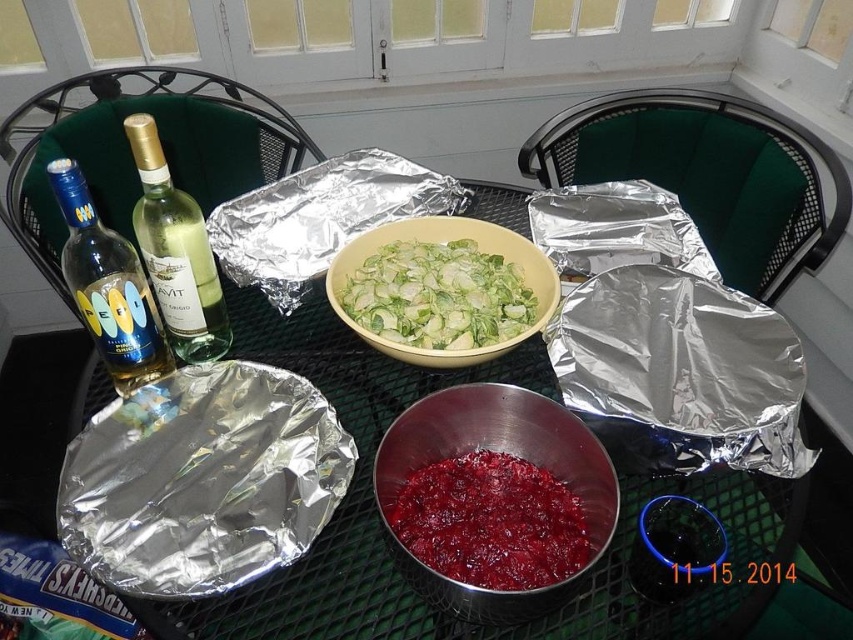
Question: Can you confirm if matte glass bottle at left is positioned above green glass bottle at upper left?

Choices:
 (A) no
 (B) yes

Answer: (A)

Question: Which of the following is the closest to the observer?

Choices:
 (A) (102, 390)
 (B) (424, 547)
 (C) (337, 308)

Answer: (B)

Question: In this image, where is metallic foil at center located relative to metallic silver bowl at lower center?

Choices:
 (A) below
 (B) above

Answer: (B)

Question: In this image, where is metallic silver bowl at lower center located relative to matte glass bottle at left?

Choices:
 (A) below
 (B) above

Answer: (A)

Question: Estimate the real-world distances between objects in this image. Which object is closer to the yellow matte bowl at center?

Choices:
 (A) shiny metallic cranberry sauce at center
 (B) matte glass bottle at left
 (C) green glass bottle at upper left

Answer: (A)

Question: Which of the following is the closest to the observer?

Choices:
 (A) (512, 256)
 (B) (144, 506)

Answer: (B)